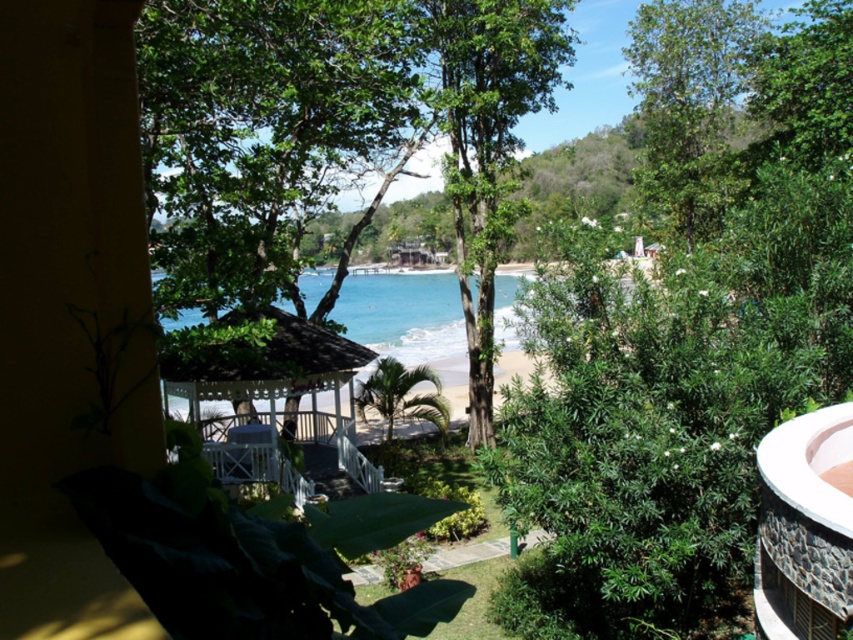
Between blue water at center and white wooden gazebo at center, which one is positioned lower?

Positioned lower is white wooden gazebo at center.

Is blue water at center behind white wooden gazebo at center?

No.

Does point (456, 339) lie in front of point (234, 392)?

That is False.

This screenshot has height=640, width=853. I want to click on blue water at center, so click(407, 317).

Is green leafy tree at upper right positioned before white wooden gazebo at center?

That is False.

How far apart are green leafy tree at upper right and white wooden gazebo at center?

18.16 meters

You are a GUI agent. You are given a task and a screenshot of the screen. Output one action in this format:
    pyautogui.click(x=<x>, y=<y>)
    Task: Click on the green leafy tree at upper right
    
    Given the screenshot: What is the action you would take?
    pyautogui.click(x=688, y=104)

Describe the element at coordinates (688, 104) in the screenshot. I see `green leafy tree at upper right` at that location.

Between green leafy tree at upper right and blue water at center, which one has less height?

Standing shorter between the two is blue water at center.

You are a GUI agent. You are given a task and a screenshot of the screen. Output one action in this format:
    pyautogui.click(x=<x>, y=<y>)
    Task: Click on the green leafy tree at upper right
    The image size is (853, 640).
    Given the screenshot: What is the action you would take?
    pyautogui.click(x=688, y=104)